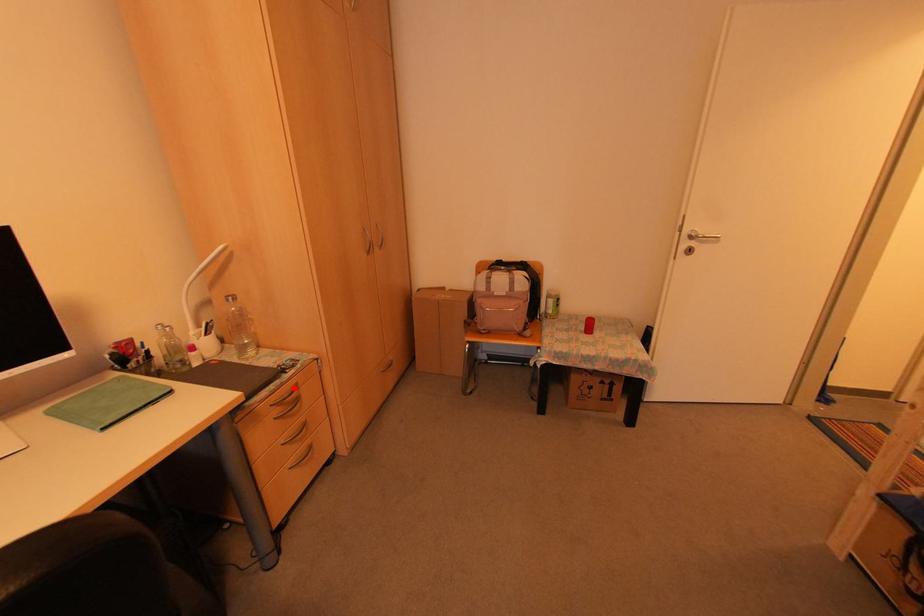
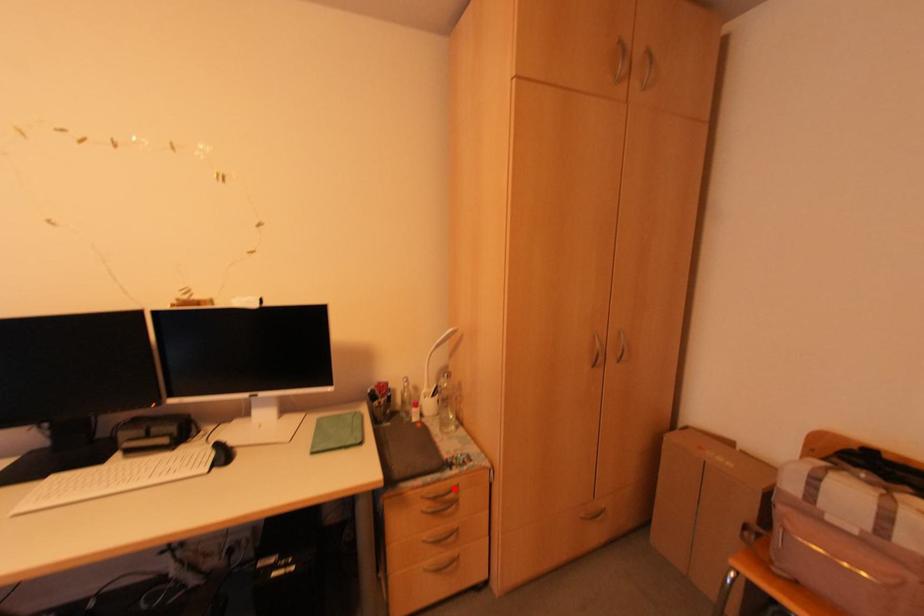
I am providing you with two images of the same scene from different viewpoints. A red point is marked on the first image and another point is marked on the second image. Is the red point in image1 aligned with the point shown in image2?

Yes